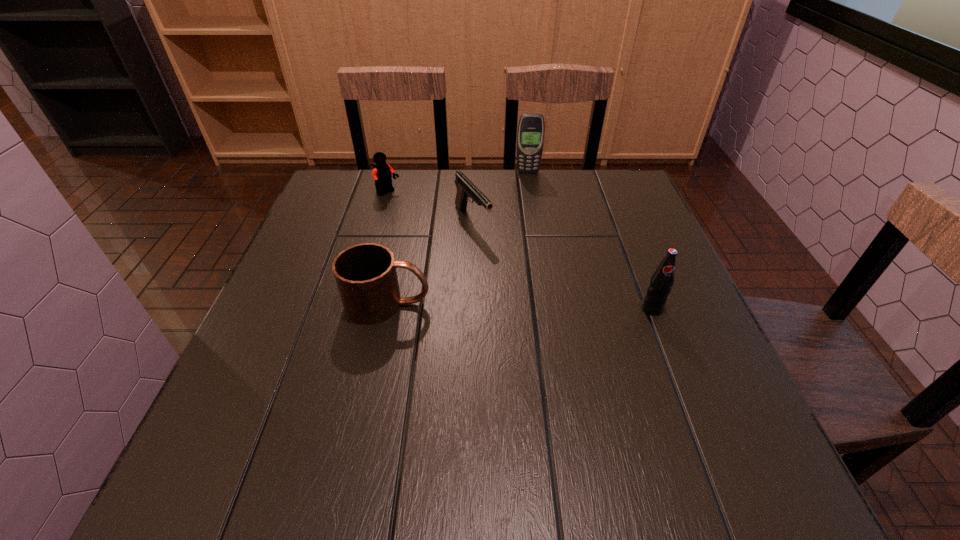
I want to click on vacant space that's between the second tallest object and the Lego, so click(520, 251).

The width and height of the screenshot is (960, 540). Find the location of `vacant area between the mug and the cellular telephone`. vacant area between the mug and the cellular telephone is located at coordinates (458, 238).

Locate which object is the third closest to the second tallest object. Please provide its 2D coordinates. Your answer should be formatted as a tuple, i.e. [(x, y)], where the tuple contains the x and y coordinates of a point satisfying the conditions above.

[(530, 136)]

Where is `object that is the fourth closest one to the mug`? object that is the fourth closest one to the mug is located at coordinates (530, 136).